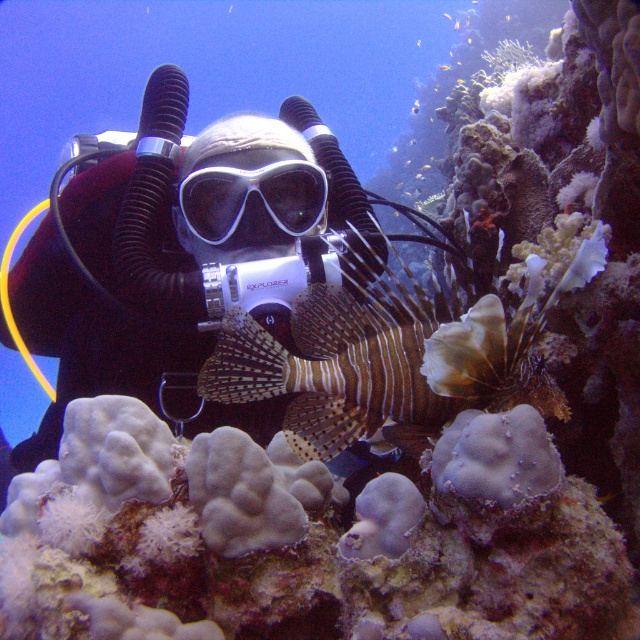
Does white matte scuba mask at center appear on the right side of translucent yellow fish at center?

Incorrect, white matte scuba mask at center is not on the right side of translucent yellow fish at center.

Looking at this image, which is more to the left, white matte scuba mask at center or translucent yellow fish at center?

From the viewer's perspective, white matte scuba mask at center appears more on the left side.

Who is more forward, (212,205) or (454,20)?

Point (212,205)

Image resolution: width=640 pixels, height=640 pixels. Find the location of `white matte scuba mask at center`. white matte scuba mask at center is located at coordinates (248, 193).

Between brown striped fish at center and translucent yellow fish at center, which one is positioned lower?

Positioned lower is brown striped fish at center.

Measure the distance between brown striped fish at center and camera.

4.20 meters

Find the location of a particular element. brown striped fish at center is located at coordinates (429, 198).

Which is in front, point (198, 406) or point (419, 205)?

Positioned in front is point (198, 406).

This screenshot has height=640, width=640. What do you see at coordinates (192, 257) in the screenshot?
I see `matte black diving suit at center` at bounding box center [192, 257].

Locate an element on the screen. matte black diving suit at center is located at coordinates (192, 257).